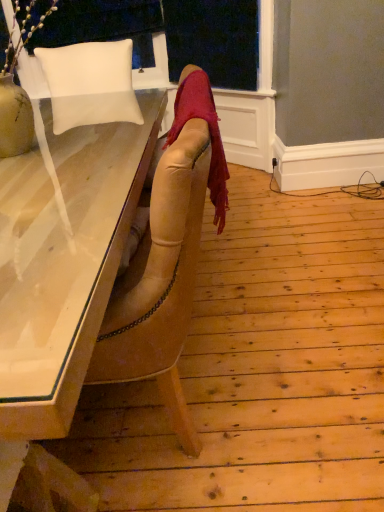
Question: Does white matte pillow at upper left appear on the left side of velvet red scarf at center?

Choices:
 (A) yes
 (B) no

Answer: (A)

Question: Considering the relative sizes of white matte pillow at upper left and velvet red scarf at center in the image provided, is white matte pillow at upper left bigger than velvet red scarf at center?

Choices:
 (A) yes
 (B) no

Answer: (A)

Question: Does white matte pillow at upper left appear on the right side of velvet red scarf at center?

Choices:
 (A) no
 (B) yes

Answer: (A)

Question: From the image's perspective, does white matte pillow at upper left appear higher than velvet red scarf at center?

Choices:
 (A) yes
 (B) no

Answer: (A)

Question: From the image's perspective, is white matte pillow at upper left below velvet red scarf at center?

Choices:
 (A) yes
 (B) no

Answer: (B)

Question: Can you confirm if white matte pillow at upper left is wider than velvet red scarf at center?

Choices:
 (A) yes
 (B) no

Answer: (A)

Question: Does white leather chair at upper left have a smaller size compared to velvet red scarf at center?

Choices:
 (A) no
 (B) yes

Answer: (A)

Question: Is white leather chair at upper left thinner than velvet red scarf at center?

Choices:
 (A) yes
 (B) no

Answer: (A)

Question: Can you confirm if white leather chair at upper left is wider than velvet red scarf at center?

Choices:
 (A) no
 (B) yes

Answer: (A)

Question: Can you confirm if white leather chair at upper left is positioned to the left of velvet red scarf at center?

Choices:
 (A) no
 (B) yes

Answer: (B)

Question: Are white leather chair at upper left and velvet red scarf at center far apart?

Choices:
 (A) yes
 (B) no

Answer: (A)

Question: From a real-world perspective, is white leather chair at upper left on top of velvet red scarf at center?

Choices:
 (A) yes
 (B) no

Answer: (A)

Question: From the image's perspective, is white leather chair at upper left located beneath white matte pillow at upper left?

Choices:
 (A) no
 (B) yes

Answer: (A)